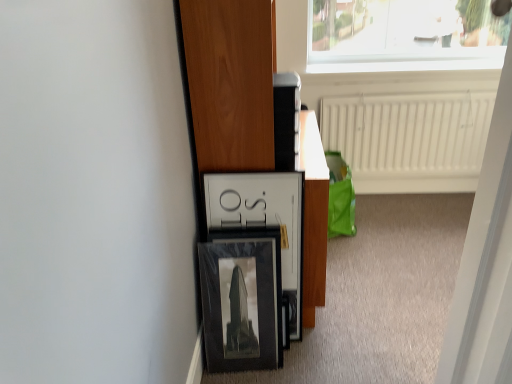
Question: From the image's perspective, is matte black frame at center above or below white plastic screen door at upper right?

Choices:
 (A) below
 (B) above

Answer: (B)

Question: Is matte black frame at center bigger or smaller than white plastic screen door at upper right?

Choices:
 (A) big
 (B) small

Answer: (A)

Question: Considering the real-world distances, which object is farthest from the matte black frame at center?

Choices:
 (A) white plastic screen door at upper right
 (B) white textured radiator at upper center

Answer: (B)

Question: Which of these objects is positioned farthest from the white plastic screen door at upper right?

Choices:
 (A) matte black frame at center
 (B) white textured radiator at upper center

Answer: (B)